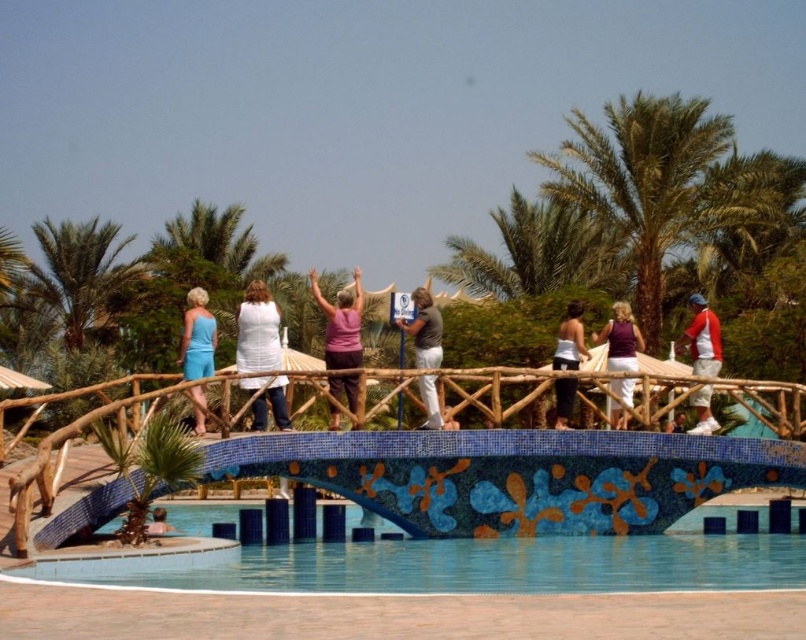
Question: Which of the following is the closest to the observer?

Choices:
 (A) (200, 301)
 (B) (580, 332)
 (C) (350, 340)

Answer: (C)

Question: Where is green leafy palm tree at upper center located in relation to violet fabric dress at center in the image?

Choices:
 (A) right
 (B) left

Answer: (A)

Question: Is white cotton shirt at center closer to camera compared to red and white shirt at upper right?

Choices:
 (A) yes
 (B) no

Answer: (A)

Question: Which object is the closest to the violet fabric dress at center?

Choices:
 (A) white cotton shirt at center
 (B) matte gray shirt at center
 (C) red and white shirt at upper right
 (D) light brown hair at lower left

Answer: (C)

Question: Does green leafy palm tree at upper left have a lesser width compared to matte blue dress at left?

Choices:
 (A) no
 (B) yes

Answer: (A)

Question: Which point is farther to the camera?

Choices:
 (A) (539, 273)
 (B) (150, 522)

Answer: (A)